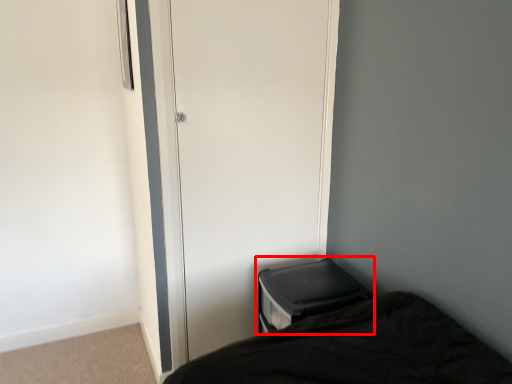
Question: From the image's perspective, what is the correct spatial positioning of changing table (annotated by the red box) in reference to screen door?

Choices:
 (A) below
 (B) above

Answer: (A)